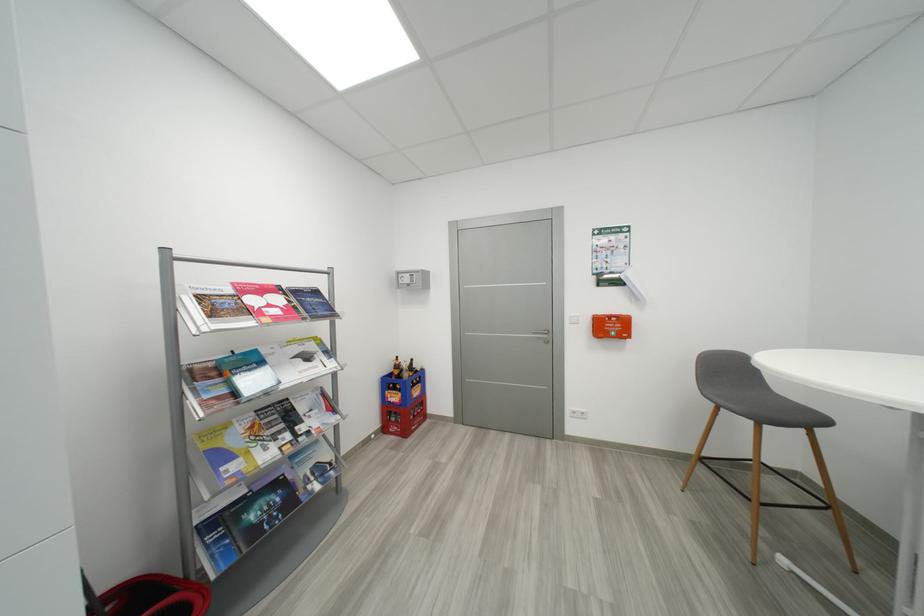
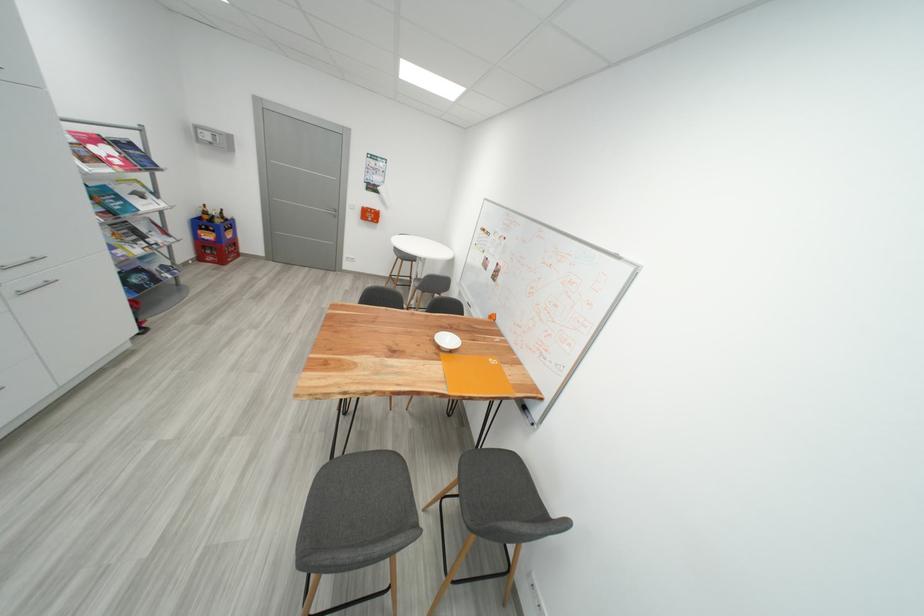
Find the pixel in the second image that matches [397,377] in the first image.

(208, 220)